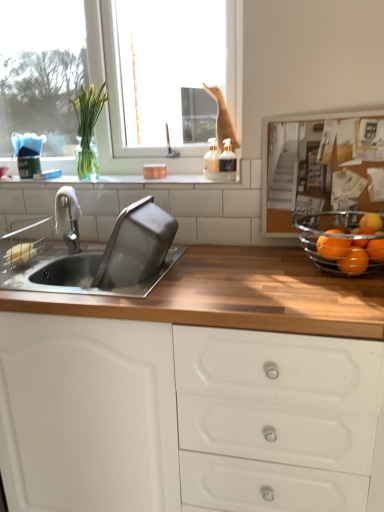
Question: Choose the correct answer: Is orange matte at right, which is the first orange from right to left, inside clear glass window at upper left or outside it?

Choices:
 (A) inside
 (B) outside

Answer: (B)

Question: Would you say orange matte at right, which is the first orange from right to left, is to the left or to the right of clear glass window at upper left in the picture?

Choices:
 (A) right
 (B) left

Answer: (A)

Question: Considering the real-world distances, which object is farthest from the stainless steel sink at left?

Choices:
 (A) clear glass bowl at right
 (B) white tile at upper center
 (C) white matte cabinet at center
 (D) green glass vase at upper left
 (E) wooden cutting board at left

Answer: (A)

Question: Estimate the real-world distances between objects in this image. Which object is closer to the stainless steel sink at left?

Choices:
 (A) green glass vase at upper left
 (B) orange matte/orange at right, which is the 3th orange in right-to-left order
 (C) satin nickel faucet at left
 (D) orange matte at right, which is the first orange from right to left
 (E) clear glass window at upper left

Answer: (C)